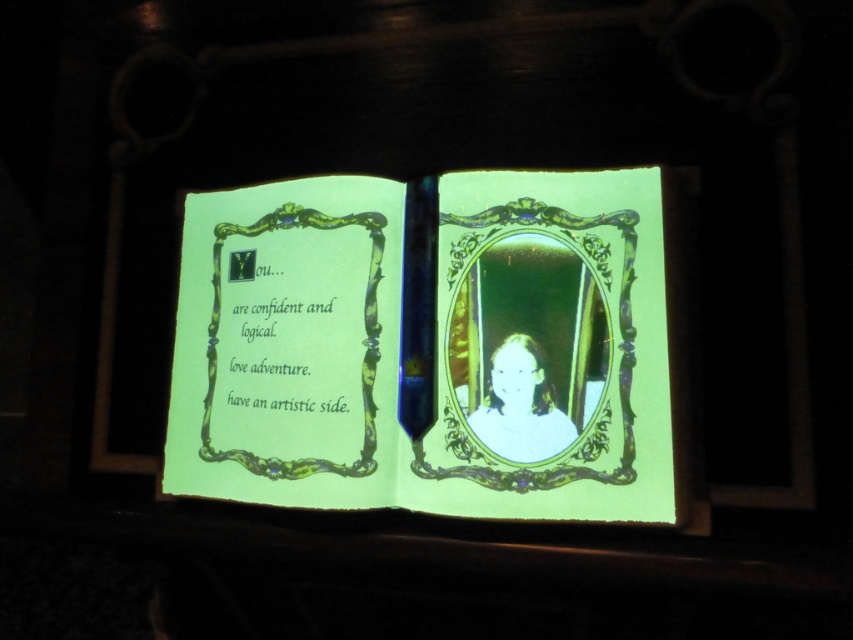
Which is behind, point (563, 314) or point (519, 397)?

Point (563, 314)

You are a GUI agent. You are given a task and a screenshot of the screen. Output one action in this format:
    pyautogui.click(x=<x>, y=<y>)
    Task: Click on the green glass mirror at center
    The width and height of the screenshot is (853, 640).
    Given the screenshot: What is the action you would take?
    [532, 348]

The width and height of the screenshot is (853, 640). I want to click on green glass mirror at center, so click(x=532, y=348).

Can you confirm if green glossy book at center is bigger than light beige fabric at center?

Indeed, green glossy book at center has a larger size compared to light beige fabric at center.

Is green glossy book at center in front of light beige fabric at center?

Yes, green glossy book at center is in front of light beige fabric at center.

Is point (572, 371) positioned before point (517, 371)?

That is True.

I want to click on green glossy book at center, so click(432, 346).

What do you see at coordinates (432, 346) in the screenshot?
I see `green glossy book at center` at bounding box center [432, 346].

Between green glossy book at center and green glass mirror at center, which one has more height?

Standing taller between the two is green glossy book at center.

Between point (641, 237) and point (566, 410), which one is positioned behind?

The point (641, 237) is more distant.

This screenshot has height=640, width=853. In order to click on green glossy book at center in this screenshot , I will do `click(432, 346)`.